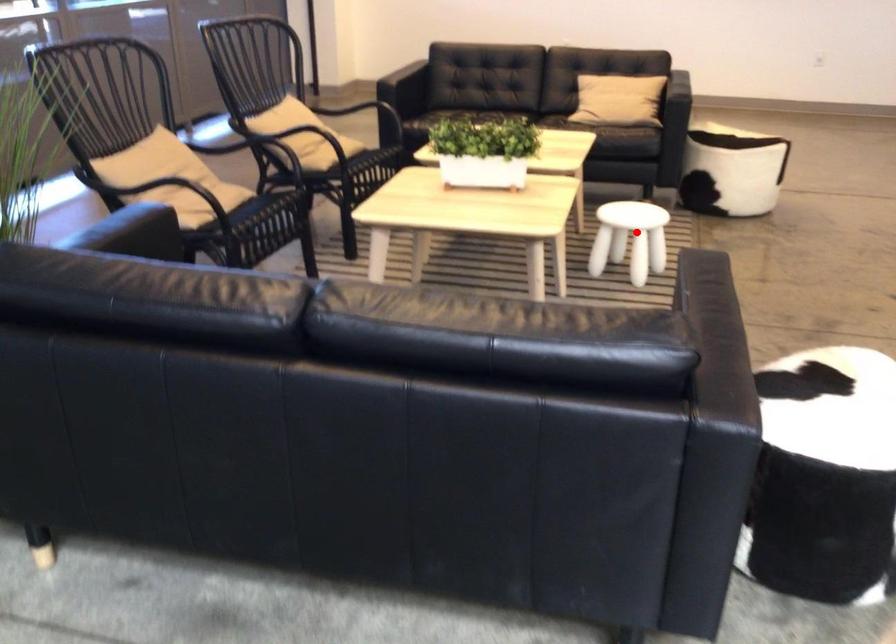
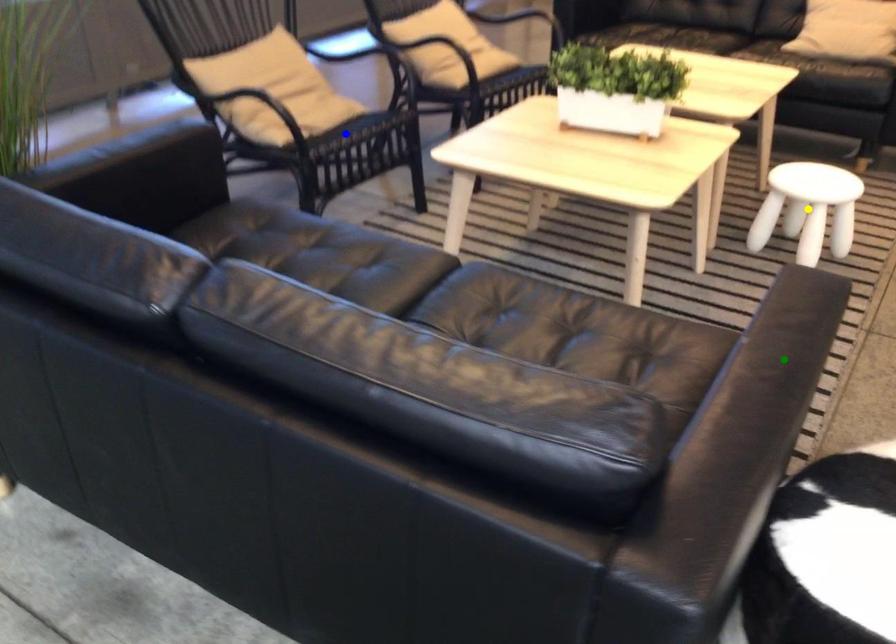
Question: I am providing you with two images of the same scene from different viewpoints. A red point is marked on the first image. You are given multiple points on the second image. In image 2, which mark is for the same physical point as the one in image 1?

Choices:
 (A) yellow point
 (B) blue point
 (C) green point

Answer: (A)